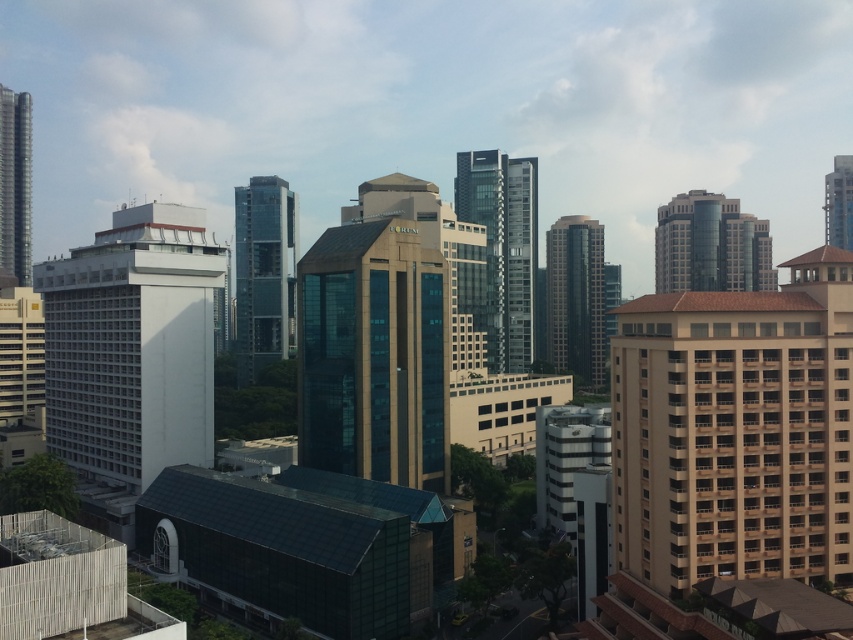
You are an architect evaluating the urban skyline. Based on the scene, which object is larger in size between the beige concrete building at right and the glassy metallic skyscraper at upper right?

The beige concrete building at right has a smaller size compared to the glassy metallic skyscraper at upper right, so the glassy metallic skyscraper at upper right is larger in size.

You are an architect analyzing the urban layout. Based on the scene, which object is located below the other between the beige concrete building at right and the glassy metallic skyscraper at upper right?

The beige concrete building at right is positioned under the glassy metallic skyscraper at upper right, meaning it is located below the skyscraper.

From the picture: You are a city planner reviewing this urban layout. You need to determine the relative positioning of the white matte building at left and the glassy brown building at upper right. Which building is positioned to the left of the other?

The white matte building at left is positioned to the left of the glassy brown building at upper right.